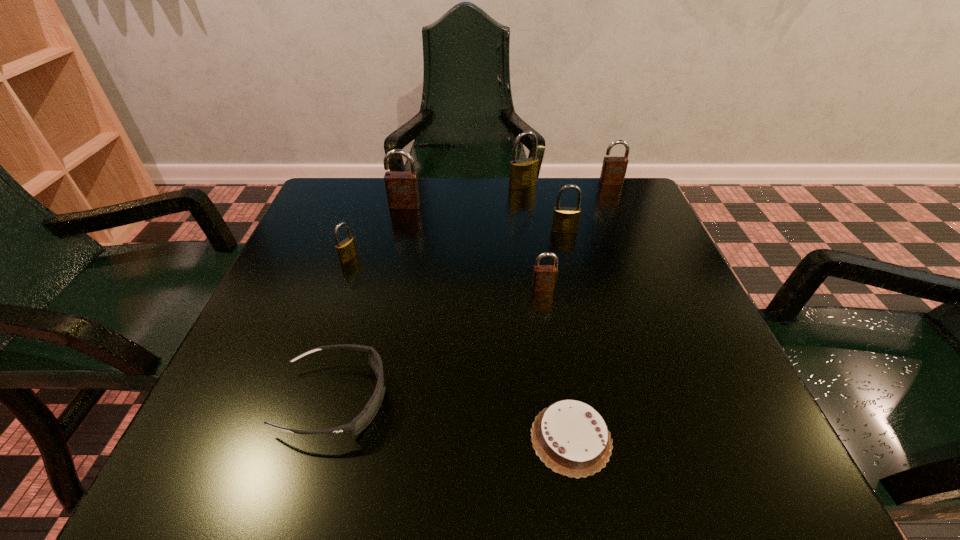
Image resolution: width=960 pixels, height=540 pixels. I want to click on the biggest brass padlock, so click(x=523, y=173).

At what (x,y) coordinates should I click in order to perform the action: click on the farthest brass padlock. Please return your answer as a coordinate pair (x, y). Looking at the image, I should click on (523, 173).

Where is `the biggest brown padlock`? The width and height of the screenshot is (960, 540). the biggest brown padlock is located at coordinates (402, 190).

You are a GUI agent. You are given a task and a screenshot of the screen. Output one action in this format:
    pyautogui.click(x=<x>, y=<y>)
    Task: Click on the third farthest object
    The width and height of the screenshot is (960, 540).
    Given the screenshot: What is the action you would take?
    pyautogui.click(x=402, y=190)

Where is `the rightmost padlock`? The height and width of the screenshot is (540, 960). the rightmost padlock is located at coordinates (613, 171).

This screenshot has height=540, width=960. I want to click on the rightmost brown padlock, so click(x=613, y=171).

The image size is (960, 540). In order to click on the third nearest padlock in this screenshot , I will do `click(565, 219)`.

Identify the location of the fourth farthest object. Image resolution: width=960 pixels, height=540 pixels. (565, 219).

The height and width of the screenshot is (540, 960). Find the location of `the second nearest padlock`. the second nearest padlock is located at coordinates (346, 250).

Locate an element on the screen. the nearest brass padlock is located at coordinates (346, 250).